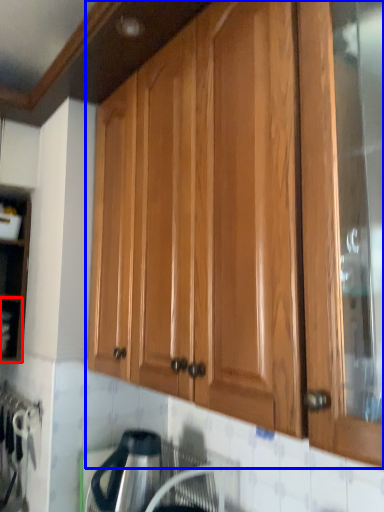
Question: Among these objects, which one is farthest to the camera, shelf (highlighted by a red box) or cabinetry (highlighted by a blue box)?

Choices:
 (A) shelf
 (B) cabinetry

Answer: (A)